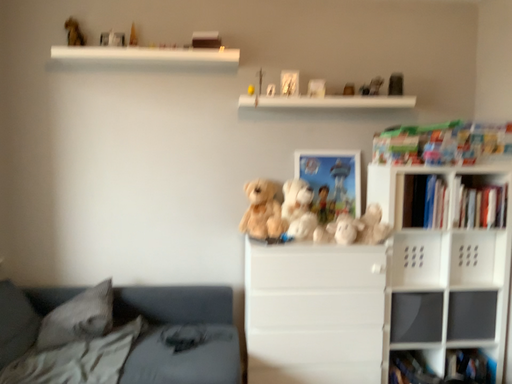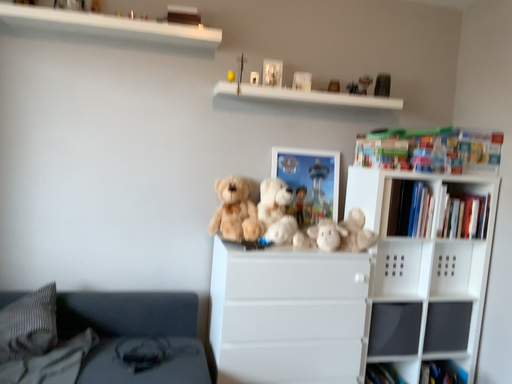
Question: How did the camera likely rotate when shooting the video?

Choices:
 (A) rotated right
 (B) rotated left

Answer: (A)